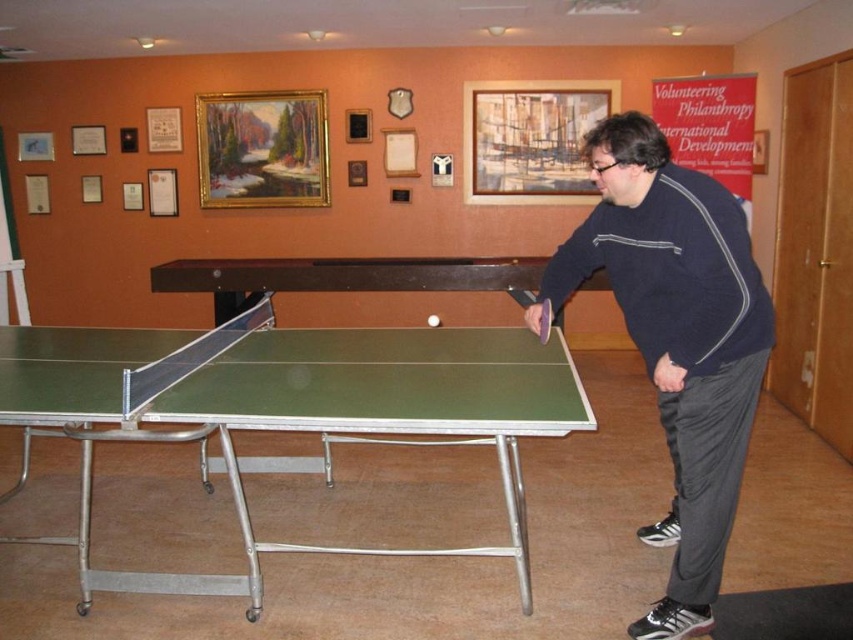
Question: Which point is closer to the camera?

Choices:
 (A) green plastic table tennis table at center
 (B) dark blue sweater at right
 (C) green rubber table at center

Answer: (B)

Question: Which object is farther from the camera taking this photo?

Choices:
 (A) green rubber table at center
 (B) green plastic table tennis table at center

Answer: (B)

Question: Is the position of green rubber table at center more distant than that of green rubber table tennis table at center?

Choices:
 (A) no
 (B) yes

Answer: (A)

Question: Which of these objects is positioned farthest from the green rubber table at center?

Choices:
 (A) green plastic table tennis table at center
 (B) dark blue sweater at right

Answer: (A)

Question: Is dark blue sweater at right bigger than green plastic table tennis table at center?

Choices:
 (A) no
 (B) yes

Answer: (B)

Question: Can you confirm if green rubber table tennis table at center is positioned to the left of green plastic table tennis table at center?

Choices:
 (A) no
 (B) yes

Answer: (A)